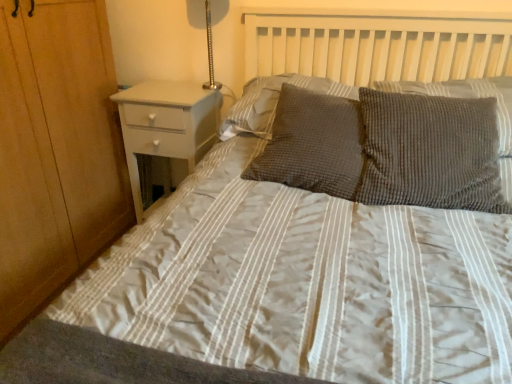
Question: Can you see textured gray pillow at center, which is counted as the second pillow, starting from the right, touching textured gray pillow at center, the 1th pillow when ordered from left to right?

Choices:
 (A) yes
 (B) no

Answer: (B)

Question: Is textured gray pillow at center, acting as the 3th pillow starting from the left, not inside textured gray pillow at center, the 1th pillow when ordered from left to right?

Choices:
 (A) no
 (B) yes

Answer: (B)

Question: Is textured gray pillow at center, acting as the 3th pillow starting from the left, thinner than textured gray pillow at center, the 1th pillow when ordered from left to right?

Choices:
 (A) no
 (B) yes

Answer: (A)

Question: Considering the relative positions of textured gray pillow at center, which is counted as the second pillow, starting from the right, and textured gray pillow at center, the 1th pillow when ordered from left to right, in the image provided, is textured gray pillow at center, which is counted as the second pillow, starting from the right, to the left of textured gray pillow at center, the 1th pillow when ordered from left to right, from the viewer's perspective?

Choices:
 (A) yes
 (B) no

Answer: (B)

Question: Can you confirm if textured gray pillow at center, which is counted as the second pillow, starting from the right, is shorter than textured gray pillow at center, arranged as the 4th pillow when viewed from the right?

Choices:
 (A) yes
 (B) no

Answer: (B)

Question: Considering the positions of textured gray pillow at center, arranged as the 4th pillow when viewed from the right, and white glossy nightstand at left in the image, is textured gray pillow at center, arranged as the 4th pillow when viewed from the right, taller or shorter than white glossy nightstand at left?

Choices:
 (A) tall
 (B) short

Answer: (B)

Question: From a real-world perspective, is textured gray pillow at center, the 1th pillow when ordered from left to right, above or below white glossy nightstand at left?

Choices:
 (A) above
 (B) below

Answer: (A)

Question: In the image, is textured gray pillow at center, the 1th pillow when ordered from left to right, positioned in front of or behind white glossy nightstand at left?

Choices:
 (A) behind
 (B) front

Answer: (B)

Question: In terms of size, does textured gray pillow at center, arranged as the 4th pillow when viewed from the right, appear bigger or smaller than white glossy nightstand at left?

Choices:
 (A) small
 (B) big

Answer: (A)

Question: Considering their positions, is textured gray pillow at center, acting as the 1th pillow starting from the right, located in front of or behind metallic silver lamp at upper right?

Choices:
 (A) behind
 (B) front

Answer: (B)

Question: From a real-world perspective, relative to metallic silver lamp at upper right, is textured gray pillow at center, acting as the 1th pillow starting from the right, vertically above or below?

Choices:
 (A) above
 (B) below

Answer: (B)

Question: Considering the relative positions of textured gray pillow at center, marked as the 4th pillow in a left-to-right arrangement, and metallic silver lamp at upper right in the image provided, is textured gray pillow at center, marked as the 4th pillow in a left-to-right arrangement, to the left or to the right of metallic silver lamp at upper right?

Choices:
 (A) left
 (B) right

Answer: (B)

Question: Is textured gray pillow at center, marked as the 4th pillow in a left-to-right arrangement, inside the boundaries of metallic silver lamp at upper right, or outside?

Choices:
 (A) outside
 (B) inside

Answer: (A)

Question: Considering the positions of textured gray pillow at center, the 1th pillow when ordered from left to right, and textured gray pillow at center, marked as the 4th pillow in a left-to-right arrangement, in the image, is textured gray pillow at center, the 1th pillow when ordered from left to right, taller or shorter than textured gray pillow at center, marked as the 4th pillow in a left-to-right arrangement,?

Choices:
 (A) tall
 (B) short

Answer: (A)

Question: From a real-world perspective, is textured gray pillow at center, arranged as the 4th pillow when viewed from the right, physically located above or below textured gray pillow at center, marked as the 4th pillow in a left-to-right arrangement?

Choices:
 (A) below
 (B) above

Answer: (A)